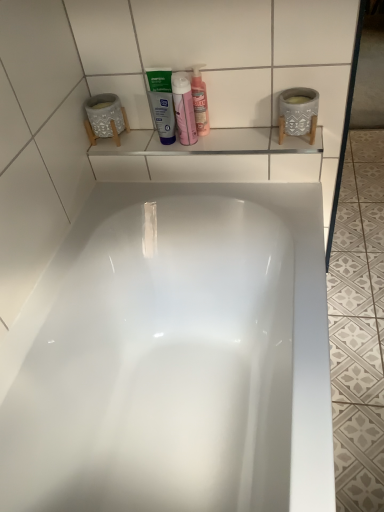
Question: Is translucent plastic bottle at upper center taller or shorter than white glossy bathtub at center?

Choices:
 (A) tall
 (B) short

Answer: (B)

Question: In terms of size, does translucent plastic bottle at upper center appear bigger or smaller than white glossy bathtub at center?

Choices:
 (A) big
 (B) small

Answer: (B)

Question: Estimate the real-world distances between objects in this image. Which object is farther from the white glossy bathtub at center?

Choices:
 (A) translucent plastic bottle at upper center
 (B) white matte tube at center

Answer: (A)

Question: Which of these objects is positioned closest to the white glossy bathtub at center?

Choices:
 (A) translucent plastic bottle at upper center
 (B) white matte tube at center

Answer: (B)